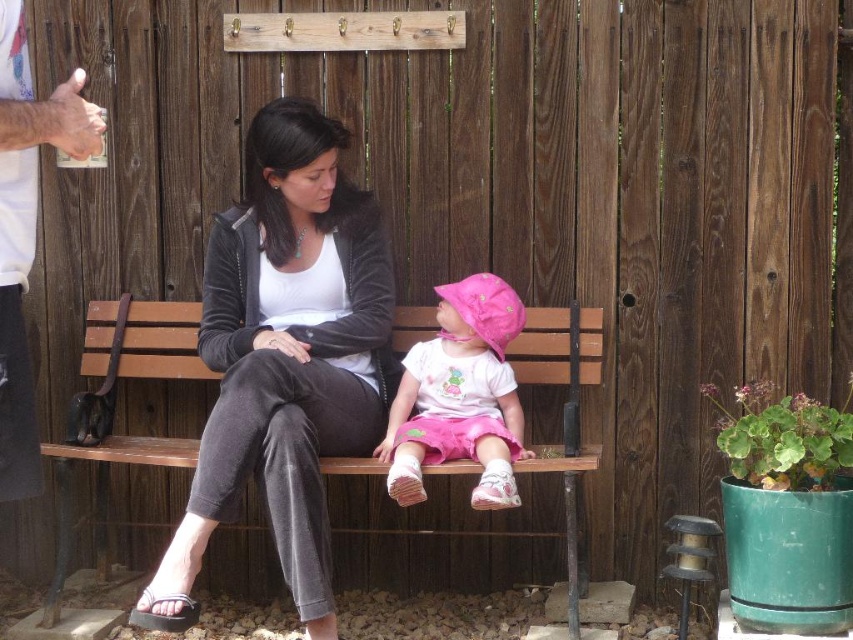
You are standing in front of the bench and want to place a small gift on the wooden rack above it. The rack has two hooks. The first hook is at point [471,384] and the second hook is at point [231,445]. Which hook is closer to you?

The hook at point [471,384] is closer to you because it is further to the viewer than the hook at point [231,445].

You are a tailor who needs to determine which item requires more fabric between the pink fabric hat at center and the black fabric pants at center. Which one would you need more fabric for?

The black fabric pants at center require more fabric because the pink fabric hat at center has a smaller width, indicating it needs less material overall.

You are a photographer setting up a shoot in this scene. You need to place a small prop between the velvet black jacket at center and the gray fabric sandal at lower left. Based on their positions, where should you place the prop so it doesn

The gray fabric sandal at lower left is behind the velvet black jacket at center, so you should place the prop in front of the velvet black jacket at center to ensure it is visible between them.